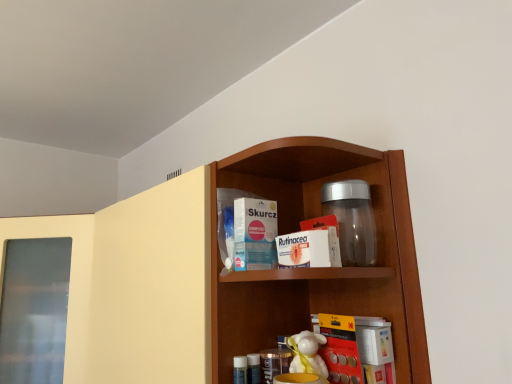
This screenshot has width=512, height=384. I want to click on white glossy toy at center, so (307, 354).

What is the approximate height of wooden shelf at center?

wooden shelf at center is 26.10 inches tall.

The image size is (512, 384). What do you see at coordinates (221, 267) in the screenshot? I see `wooden shelf at center` at bounding box center [221, 267].

The image size is (512, 384). I want to click on white cardboard box at center, the first product in the right-to-left sequence, so click(x=305, y=249).

Find the location of a particular element. The width and height of the screenshot is (512, 384). white glossy toy at center is located at coordinates (307, 354).

The height and width of the screenshot is (384, 512). I want to click on the 1st product to the left of the white glossy toy at center, counting from the anchor's position, so click(305, 249).

What's the angular difference between white glossy toy at center and white cardboard box at center, the 2th product positioned from the left,'s facing directions?

3.33 degrees separate the facing orientations of white glossy toy at center and white cardboard box at center, the 2th product positioned from the left.

In the image, is white glossy toy at center on the left side or the right side of white cardboard box at center, the 2th product positioned from the left?

From the image, it's evident that white glossy toy at center is to the right of white cardboard box at center, the 2th product positioned from the left.

Is transparent plastic jar at upper center aimed at white glossy toy at center?

No, transparent plastic jar at upper center is not oriented towards white glossy toy at center.

Identify the location of glass jar above the white glossy toy at center (from a real-world perspective). (352, 220).

Considering the positions of objects transparent plastic jar at upper center and white glossy toy at center in the image provided, who is more to the right, transparent plastic jar at upper center or white glossy toy at center?

transparent plastic jar at upper center is more to the right.

Is transparent plastic jar at upper center taller than white glossy toy at center?

Correct, transparent plastic jar at upper center is much taller as white glossy toy at center.

What's the angular difference between yellow matte book at lower center and white paper packet at center, which is the second product from right to left,'s facing directions?

The facing directions of yellow matte book at lower center and white paper packet at center, which is the second product from right to left, are 100 degrees apart.

Based on their positions, is yellow matte book at lower center located to the left or right of white paper packet at center, which is the second product from right to left?

yellow matte book at lower center is to the right of white paper packet at center, which is the second product from right to left.

Is yellow matte book at lower center positioned beyond the bounds of white paper packet at center, acting as the 1th product starting from the left?

That's correct, yellow matte book at lower center is outside of white paper packet at center, acting as the 1th product starting from the left.

Which is behind, point (344, 360) or point (269, 234)?

The point (344, 360) is farther.

Which object is positioned more to the left, white glossy toy at center or yellow matte book at lower center?

From the viewer's perspective, white glossy toy at center appears more on the left side.

What's the angular difference between white glossy toy at center and yellow matte book at lower center's facing directions?

The angle between the facing direction of white glossy toy at center and the facing direction of yellow matte book at lower center is 9.05 degrees.

Would you say white glossy toy at center contains yellow matte book at lower center?

No, yellow matte book at lower center is not surrounded by white glossy toy at center.

Could you tell me if white glossy toy at center is turned towards yellow matte book at lower center?

No, white glossy toy at center does not turn towards yellow matte book at lower center.

Is white paper packet at center, which is the second product from right to left, facing towards transparent plastic jar at upper center?

No.

How distant is white paper packet at center, which is the second product from right to left, from transparent plastic jar at upper center?

6.71 inches.

From a real-world perspective, is white paper packet at center, which is the second product from right to left, located beneath transparent plastic jar at upper center?

Yes, from a real-world perspective, white paper packet at center, which is the second product from right to left, is below transparent plastic jar at upper center.

Could you tell me if white cardboard box at center, the 2th product positioned from the left, is turned towards transparent plastic jar at upper center?

No.

Is white cardboard box at center, the 2th product positioned from the left, situated inside transparent plastic jar at upper center or outside?

white cardboard box at center, the 2th product positioned from the left, cannot be found inside transparent plastic jar at upper center.

Considering the relative sizes of white cardboard box at center, the first product in the right-to-left sequence, and transparent plastic jar at upper center in the image provided, is white cardboard box at center, the first product in the right-to-left sequence, shorter than transparent plastic jar at upper center?

Indeed, white cardboard box at center, the first product in the right-to-left sequence, has a lesser height compared to transparent plastic jar at upper center.

Would you say white cardboard box at center, the 2th product positioned from the left, is part of white paper packet at center, acting as the 1th product starting from the left,'s contents?

No.

How much distance is there between white paper packet at center, which is the second product from right to left, and white cardboard box at center, the first product in the right-to-left sequence?

The distance of white paper packet at center, which is the second product from right to left, from white cardboard box at center, the first product in the right-to-left sequence, is 2.55 inches.

Find the location of `product above the white cardboard box at center, the 2th product positioned from the left (from a real-world perspective)`. product above the white cardboard box at center, the 2th product positioned from the left (from a real-world perspective) is located at coordinates (255, 234).

Between white paper packet at center, acting as the 1th product starting from the left, and white cardboard box at center, the first product in the right-to-left sequence, which one has less height?

white cardboard box at center, the first product in the right-to-left sequence.

The image size is (512, 384). I want to click on toy located on the right of white cardboard box at center, the first product in the right-to-left sequence, so click(x=307, y=354).

Locate an element on the screen. The width and height of the screenshot is (512, 384). toy lying behind the transparent plastic jar at upper center is located at coordinates (307, 354).

From the picture: Considering their positions, is yellow matte book at lower center positioned further to wooden shelf at center than white paper packet at center, acting as the 1th product starting from the left?

The object further to wooden shelf at center is yellow matte book at lower center.

Based on their spatial positions, is white paper packet at center, acting as the 1th product starting from the left, or wooden shelf at center closer to white cardboard box at center, the first product in the right-to-left sequence?

Based on the image, white paper packet at center, acting as the 1th product starting from the left, appears to be nearer to white cardboard box at center, the first product in the right-to-left sequence.

Which object lies nearer to the anchor point white cardboard box at center, the first product in the right-to-left sequence, white glossy toy at center or wooden shelf at center?

Among the two, white glossy toy at center is located nearer to white cardboard box at center, the first product in the right-to-left sequence.

Estimate the real-world distances between objects in this image. Which object is further from wooden shelf at center, white cardboard box at center, the 2th product positioned from the left, or white glossy toy at center?

white glossy toy at center.

Looking at the image, which one is located further to transparent plastic jar at upper center, white cardboard box at center, the first product in the right-to-left sequence, or wooden shelf at center?

Based on the image, wooden shelf at center appears to be further to transparent plastic jar at upper center.

Looking at the image, which one is located closer to white paper packet at center, which is the second product from right to left, yellow matte book at lower center or wooden shelf at center?

yellow matte book at lower center lies closer to white paper packet at center, which is the second product from right to left, than the other object.

From the image, which object appears to be farther from wooden shelf at center, white paper packet at center, acting as the 1th product starting from the left, or yellow matte book at lower center?

The object further to wooden shelf at center is yellow matte book at lower center.

Estimate the real-world distances between objects in this image. Which object is further from wooden shelf at center, yellow matte book at lower center or white glossy toy at center?

Based on the image, yellow matte book at lower center appears to be further to wooden shelf at center.

Where is `product between wooden shelf at center and white cardboard box at center, the first product in the right-to-left sequence, from left to right`? The height and width of the screenshot is (384, 512). product between wooden shelf at center and white cardboard box at center, the first product in the right-to-left sequence, from left to right is located at coordinates (255, 234).

Find the location of a particular element. product between white paper packet at center, acting as the 1th product starting from the left, and transparent plastic jar at upper center is located at coordinates pos(305,249).

This screenshot has height=384, width=512. Identify the location of product that lies between white paper packet at center, which is the second product from right to left, and white glossy toy at center from top to bottom. (305, 249).

Identify the location of toy located between wooden shelf at center and transparent plastic jar at upper center in the left-right direction. The width and height of the screenshot is (512, 384). (307, 354).